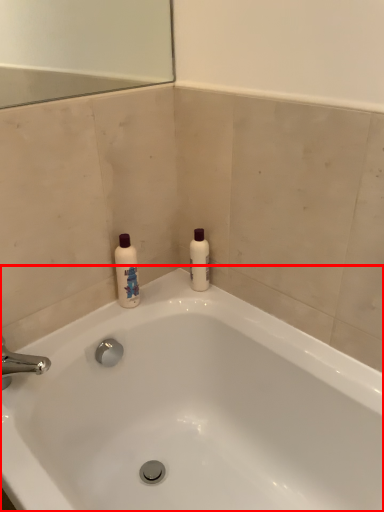
Question: Observing the image, what is the correct spatial positioning of bathtub (annotated by the red box) in reference to cleaning product?

Choices:
 (A) left
 (B) right

Answer: (A)